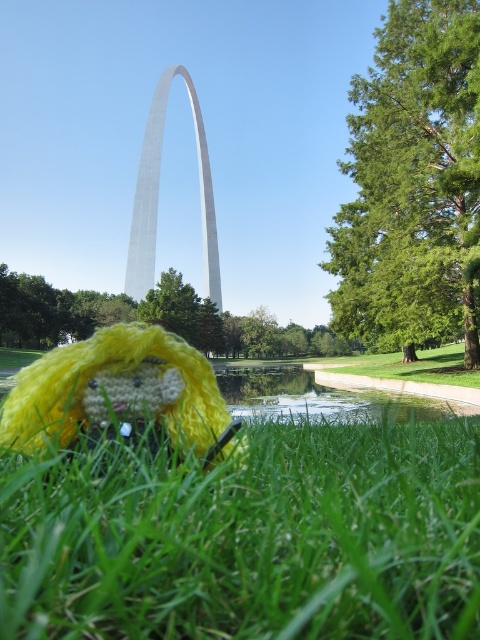
Question: Is green fuzzy grass at lower left smaller than silver metallic gateway arch at center?

Choices:
 (A) yes
 (B) no

Answer: (A)

Question: Where is yellow yarn toy at lower left located in relation to silver metallic gateway arch at center in the image?

Choices:
 (A) right
 (B) left

Answer: (A)

Question: Considering the real-world distances, which object is farthest from the yellow yarn toy at lower left?

Choices:
 (A) green fuzzy grass at lower left
 (B) silver metallic gateway arch at center

Answer: (B)

Question: Is green fuzzy grass at lower left to the left of silver metallic gateway arch at center from the viewer's perspective?

Choices:
 (A) yes
 (B) no

Answer: (B)

Question: Which object is the closest to the yellow yarn toy at lower left?

Choices:
 (A) green fuzzy grass at lower left
 (B) silver metallic gateway arch at center

Answer: (A)

Question: Which of the following is the farthest from the observer?

Choices:
 (A) (144, 218)
 (B) (467, 600)

Answer: (A)